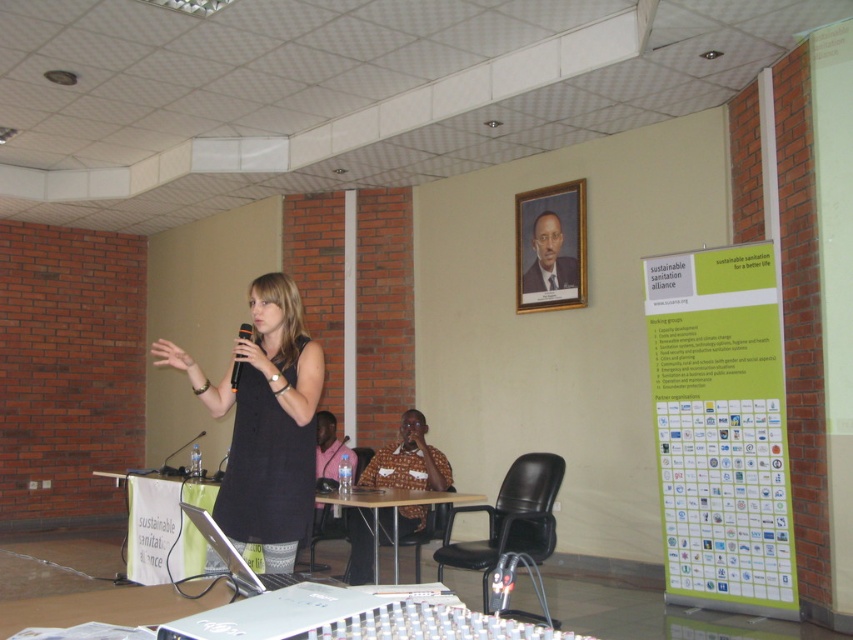
Is black matte dress at center closer to camera compared to black plastic chair at lower center?

Yes.

The height and width of the screenshot is (640, 853). What do you see at coordinates (264, 422) in the screenshot? I see `black matte dress at center` at bounding box center [264, 422].

At what (x,y) coordinates should I click in order to perform the action: click on black matte dress at center. Please return your answer as a coordinate pair (x, y). Looking at the image, I should click on (264, 422).

Who is shorter, green paper poster at right or gold-framed portrait at upper center?

gold-framed portrait at upper center

Consider the image. How distant is green paper poster at right from gold-framed portrait at upper center?

green paper poster at right and gold-framed portrait at upper center are 4.88 feet apart from each other.

Who is more distant from viewer, (x=686, y=388) or (x=563, y=300)?

The point (x=563, y=300) is more distant.

Where is `green paper poster at right`? The width and height of the screenshot is (853, 640). green paper poster at right is located at coordinates (721, 429).

Can you confirm if black leather chair at center is positioned below pink fabric shirt at center?

Yes.

Describe the element at coordinates (509, 518) in the screenshot. I see `black leather chair at center` at that location.

Where is `black leather chair at center`? The height and width of the screenshot is (640, 853). black leather chair at center is located at coordinates (509, 518).

At what (x,y) coordinates should I click in order to perform the action: click on black leather chair at center. Please return your answer as a coordinate pair (x, y). The image size is (853, 640). Looking at the image, I should click on (509, 518).